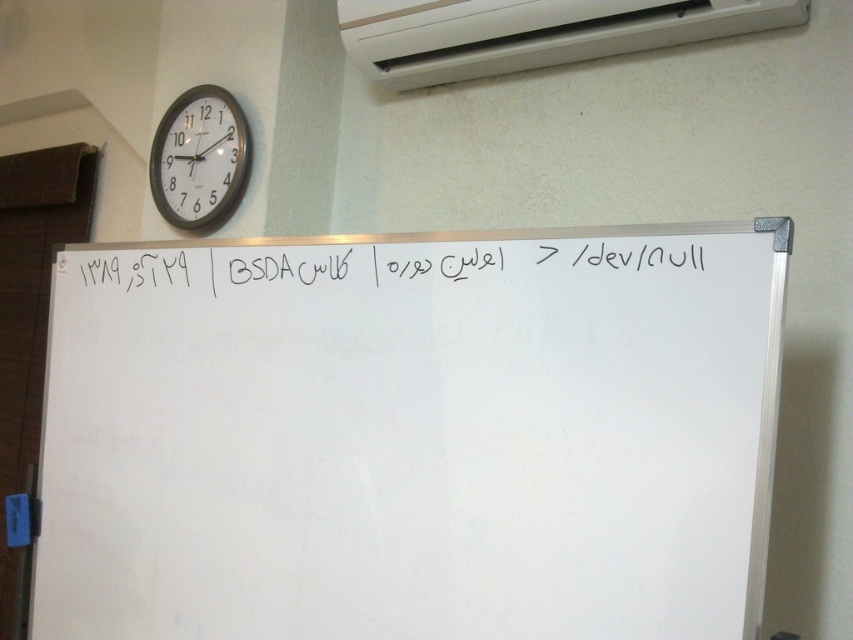
Can you confirm if white matte whiteboard at center is shorter than white plastic clock at upper left?

Incorrect, white matte whiteboard at center's height does not fall short of white plastic clock at upper left's.

Which is above, white matte whiteboard at center or white plastic clock at upper left?

white plastic clock at upper left is higher up.

Find the location of `white matte whiteboard at center`. white matte whiteboard at center is located at coordinates (412, 436).

The width and height of the screenshot is (853, 640). Identify the location of white matte whiteboard at center. (412, 436).

Does white matte whiteboard at center have a greater height compared to white plastic air conditioning unit at upper center?

Correct, white matte whiteboard at center is much taller as white plastic air conditioning unit at upper center.

Between white matte whiteboard at center and white plastic air conditioning unit at upper center, which one appears on the right side from the viewer's perspective?

Positioned to the right is white plastic air conditioning unit at upper center.

Between point (469, 488) and point (457, 81), which one is positioned behind?

Point (457, 81)

Where is `white matte whiteboard at center`? Image resolution: width=853 pixels, height=640 pixels. white matte whiteboard at center is located at coordinates (412, 436).

Is black chalk writing at center shorter than white plastic clock at upper left?

Indeed, black chalk writing at center has a lesser height compared to white plastic clock at upper left.

Who is positioned more to the right, black chalk writing at center or white plastic clock at upper left?

From the viewer's perspective, black chalk writing at center appears more on the right side.

Between point (601, 266) and point (207, 92), which one is positioned in front?

Positioned in front is point (601, 266).

You are a GUI agent. You are given a task and a screenshot of the screen. Output one action in this format:
    pyautogui.click(x=<x>, y=<y>)
    Task: Click on the black chalk writing at center
    
    Given the screenshot: What is the action you would take?
    pyautogui.click(x=364, y=260)